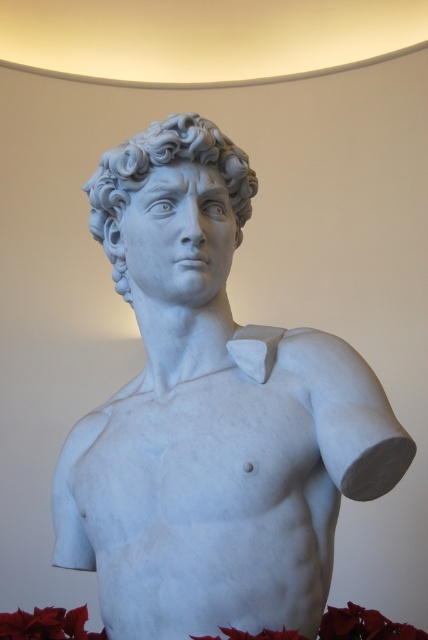
Question: Is white marble bust at center closer to camera compared to white marble head at center?

Choices:
 (A) yes
 (B) no

Answer: (A)

Question: Is white marble bust at center to the left of white marble head at center from the viewer's perspective?

Choices:
 (A) no
 (B) yes

Answer: (A)

Question: Is white marble bust at center behind white marble head at center?

Choices:
 (A) no
 (B) yes

Answer: (A)

Question: Which point is farther from the camera taking this photo?

Choices:
 (A) (357, 356)
 (B) (213, 148)

Answer: (B)

Question: Which of the following is the farthest from the observer?

Choices:
 (A) white marble head at center
 (B) white marble bust at center

Answer: (A)